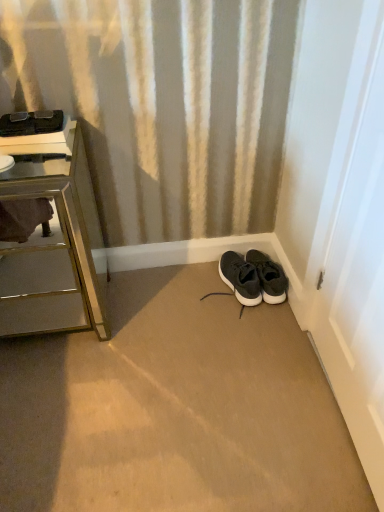
Identify the location of free space that is in between white glossy door at right and metallic mirrored chest of drawers at left. The image size is (384, 512). (185, 365).